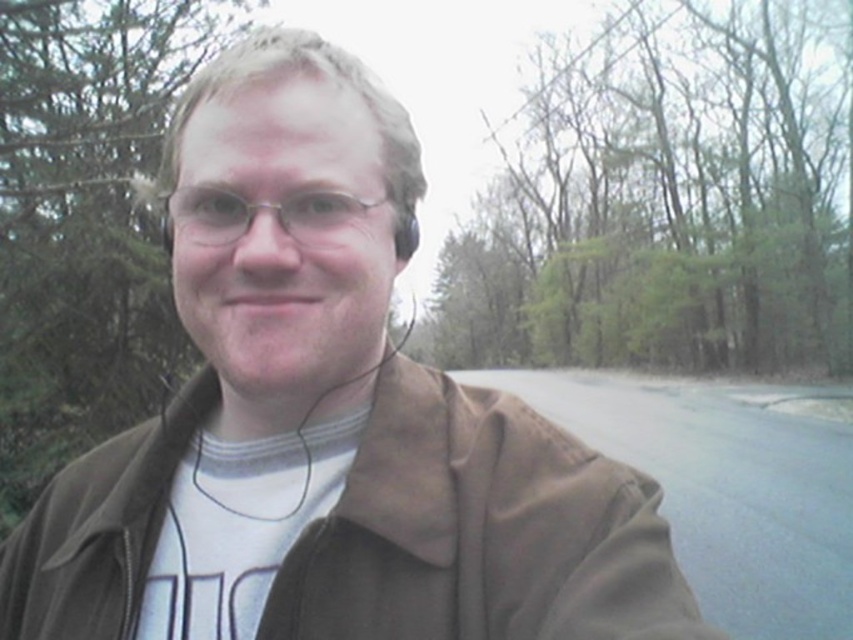
Is brown matte jacket at center wider than metallic silver glasses at center?

Yes, brown matte jacket at center is wider than metallic silver glasses at center.

Is brown matte jacket at center shorter than metallic silver glasses at center?

No.

At what (x,y) coordinates should I click in order to perform the action: click on brown matte jacket at center. Please return your answer as a coordinate pair (x, y). This screenshot has width=853, height=640. Looking at the image, I should click on (480, 531).